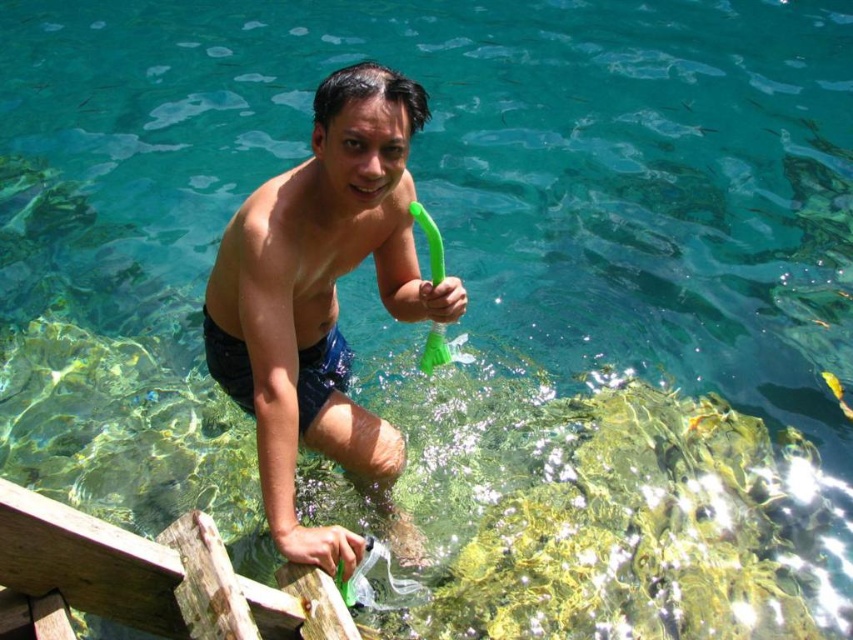
Based on the photo, does shiny blue shorts at center appear on the left side of dark blue fabric shorts at center?

Incorrect, shiny blue shorts at center is not on the left side of dark blue fabric shorts at center.

Which is below, shiny blue shorts at center or dark blue fabric shorts at center?

dark blue fabric shorts at center is lower down.

Which is in front, point (288, 365) or point (299, 419)?

Point (288, 365) is more forward.

Identify the location of shiny blue shorts at center. (321, 298).